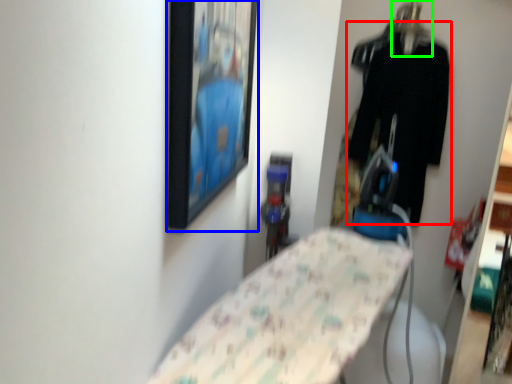
Question: Which is nearer to the clothing (highlighted by a red box)? picture frame (highlighted by a blue box) or hanger (highlighted by a green box).

Choices:
 (A) picture frame
 (B) hanger

Answer: (B)